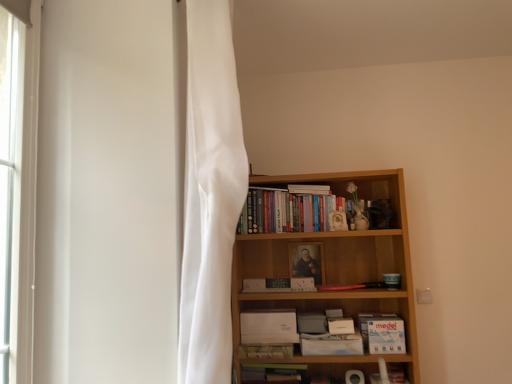
Question: Can you confirm if white sheer curtain at left is thinner than matte white paperback book at center, placed as the 3th paperback book when sorted from left to right?

Choices:
 (A) yes
 (B) no

Answer: (A)

Question: Is matte white paperback book at center, placed as the 3th paperback book when sorted from left to right, completely or partially inside white sheer curtain at left?

Choices:
 (A) yes
 (B) no

Answer: (B)

Question: Is white sheer curtain at left placed right next to matte white paperback book at center, positioned as the fourth paperback book in right-to-left order?

Choices:
 (A) yes
 (B) no

Answer: (B)

Question: From the image's perspective, is white sheer curtain at left beneath matte white paperback book at center, placed as the 3th paperback book when sorted from left to right?

Choices:
 (A) yes
 (B) no

Answer: (B)

Question: Is white sheer curtain at left turned away from matte white paperback book at center, placed as the 3th paperback book when sorted from left to right?

Choices:
 (A) no
 (B) yes

Answer: (A)

Question: Is point [x=334, y=319] positioned closer to the camera than point [x=303, y=188]?

Choices:
 (A) farther
 (B) closer

Answer: (B)

Question: From a real-world perspective, is white matte paperback book at lower right, the 5th paperback book from the left, positioned above or below white paper book at upper center, the 3th book positioned from the bottom?

Choices:
 (A) below
 (B) above

Answer: (A)

Question: Considering the positions of white matte paperback book at lower right, the 5th paperback book from the left, and white paper book at upper center, the 3th book positioned from the bottom, in the image, is white matte paperback book at lower right, the 5th paperback book from the left, taller or shorter than white paper book at upper center, the 3th book positioned from the bottom,?

Choices:
 (A) short
 (B) tall

Answer: (B)

Question: Relative to white paper book at upper center, the 3th book positioned from the bottom, is white matte paperback book at lower right, the 5th paperback book from the left, in front or behind?

Choices:
 (A) front
 (B) behind

Answer: (A)

Question: Does point (197, 291) appear closer or farther from the camera than point (318, 188)?

Choices:
 (A) farther
 (B) closer

Answer: (B)

Question: Relative to white paper book at upper center, the 3th book positioned from the bottom, is white sheer curtain at left in front or behind?

Choices:
 (A) front
 (B) behind

Answer: (A)

Question: From the image's perspective, is white sheer curtain at left above or below white paper book at upper center, placed as the 1th book when sorted from top to bottom?

Choices:
 (A) below
 (B) above

Answer: (B)

Question: In terms of height, does white sheer curtain at left look taller or shorter compared to white paper book at upper center, placed as the 1th book when sorted from top to bottom?

Choices:
 (A) short
 (B) tall

Answer: (B)

Question: In the image, is white matte paperback book at lower center, placed as the 5th paperback book when sorted from right to left, positioned in front of or behind white matte paperback book at lower right, which is the second paperback book in right-to-left order?

Choices:
 (A) front
 (B) behind

Answer: (B)

Question: Would you say white matte paperback book at lower center, placed as the 5th paperback book when sorted from right to left, is to the left or to the right of white matte paperback book at lower right, the 5th paperback book from the left, in the picture?

Choices:
 (A) left
 (B) right

Answer: (A)